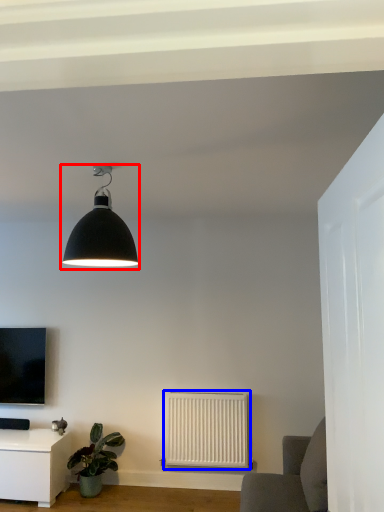
Question: Which of the following is the farthest to the observer, lamp (highlighted by a red box) or radiator (highlighted by a blue box)?

Choices:
 (A) lamp
 (B) radiator

Answer: (B)